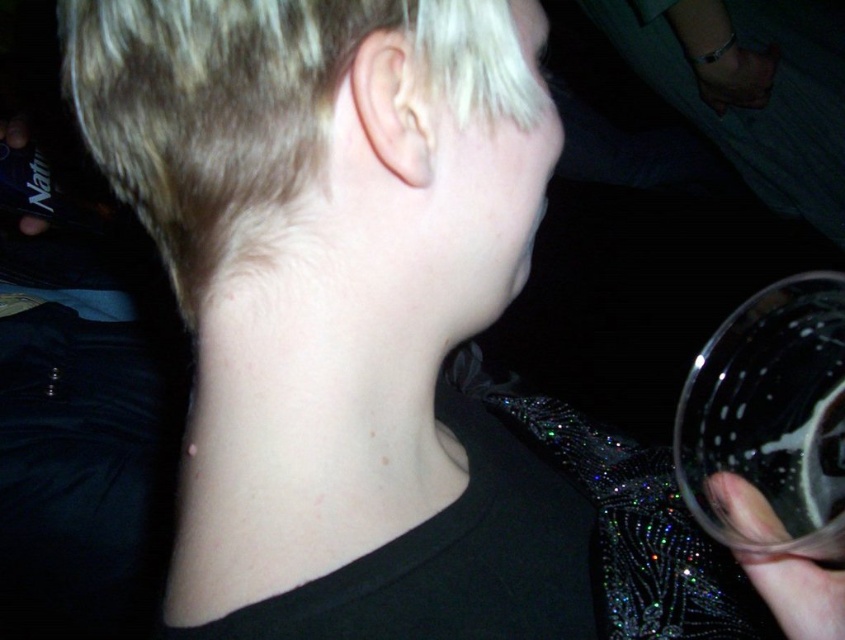
Does transparent plastic cup at lower right have a lesser height compared to translucent glass at right?

In fact, transparent plastic cup at lower right may be taller than translucent glass at right.

Which is below, transparent plastic cup at lower right or translucent glass at right?

Positioned lower is translucent glass at right.

Locate an element on the screen. transparent plastic cup at lower right is located at coordinates (771, 416).

What are the coordinates of `transparent plastic cup at lower right` in the screenshot? It's located at (x=771, y=416).